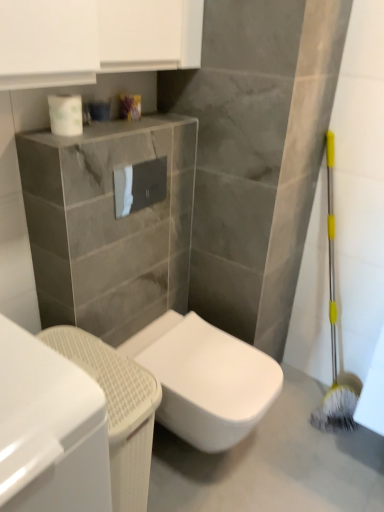
Question: Does white glossy toilet paper at center, which is the second toilet paper in left-to-right order, have a lesser width compared to white glossy toilet at center?

Choices:
 (A) yes
 (B) no

Answer: (A)

Question: Is white glossy toilet paper at center, marked as the first toilet paper in a right-to-left arrangement, wider than white glossy toilet at center?

Choices:
 (A) yes
 (B) no

Answer: (B)

Question: Does white glossy toilet paper at center, the 1th toilet paper from the bottom, touch white glossy toilet at center?

Choices:
 (A) no
 (B) yes

Answer: (A)

Question: Does white glossy toilet paper at center, the first toilet paper from the back, have a larger size compared to white glossy toilet at center?

Choices:
 (A) yes
 (B) no

Answer: (B)

Question: From the image's perspective, would you say white glossy toilet paper at center, arranged as the 2th toilet paper when viewed from the front, is shown under white glossy toilet at center?

Choices:
 (A) no
 (B) yes

Answer: (A)

Question: From the image's perspective, relative to white glossy toilet at lower left, is white glossy toilet at center above or below?

Choices:
 (A) below
 (B) above

Answer: (A)

Question: Does point (375, 441) appear closer or farther from the camera than point (135, 456)?

Choices:
 (A) closer
 (B) farther

Answer: (B)

Question: Looking at their shapes, would you say white glossy toilet at center is wider or thinner than white glossy toilet at lower left?

Choices:
 (A) wide
 (B) thin

Answer: (A)

Question: Choose the correct answer: Is white glossy toilet at center inside white glossy toilet at lower left or outside it?

Choices:
 (A) outside
 (B) inside

Answer: (A)

Question: Is white glossy toilet paper at upper center, the 1th toilet paper when ordered from top to bottom, taller or shorter than white glossy cabinet at lower left?

Choices:
 (A) tall
 (B) short

Answer: (B)

Question: From the image's perspective, is white glossy toilet paper at upper center, the second toilet paper when ordered from bottom to top, positioned above or below white glossy cabinet at lower left?

Choices:
 (A) below
 (B) above

Answer: (B)

Question: Is point click(67, 119) positioned closer to the camera than point click(44, 450)?

Choices:
 (A) closer
 (B) farther

Answer: (B)

Question: Is white glossy toilet paper at upper center, the 1th toilet paper viewed from the left, inside or outside of white glossy cabinet at lower left?

Choices:
 (A) outside
 (B) inside

Answer: (A)

Question: Considering the positions of white glossy cabinet at lower left and white glossy toilet at center in the image, is white glossy cabinet at lower left taller or shorter than white glossy toilet at center?

Choices:
 (A) short
 (B) tall

Answer: (B)

Question: From the image's perspective, relative to white glossy toilet at center, is white glossy cabinet at lower left above or below?

Choices:
 (A) below
 (B) above

Answer: (A)